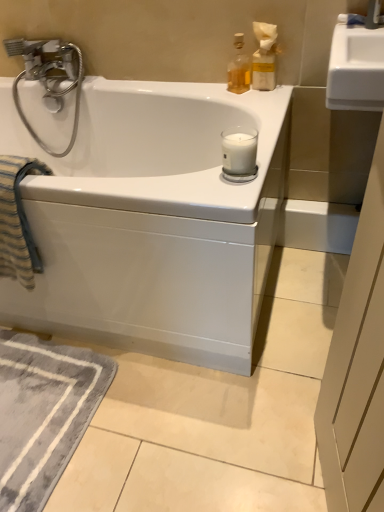
Question: From the image's perspective, is striped cotton beach towel at left under translucent glass bottle at upper right, acting as the first bottle starting from the left?

Choices:
 (A) yes
 (B) no

Answer: (A)

Question: Is striped cotton beach towel at left facing towards translucent glass bottle at upper right, acting as the first bottle starting from the left?

Choices:
 (A) no
 (B) yes

Answer: (A)

Question: Could translucent glass bottle at upper right, arranged as the 2th bottle when viewed from the right, be considered to be inside striped cotton beach towel at left?

Choices:
 (A) no
 (B) yes

Answer: (A)

Question: Can you confirm if striped cotton beach towel at left is thinner than translucent glass bottle at upper right, acting as the first bottle starting from the left?

Choices:
 (A) yes
 (B) no

Answer: (B)

Question: Is there a large distance between striped cotton beach towel at left and translucent glass bottle at upper right, acting as the first bottle starting from the left?

Choices:
 (A) yes
 (B) no

Answer: (B)

Question: Is striped cotton beach towel at left closer to camera compared to translucent glass bottle at upper right, acting as the first bottle starting from the left?

Choices:
 (A) yes
 (B) no

Answer: (A)

Question: Does gray soft rug at lower left have a greater width compared to white matte glass candle at upper right?

Choices:
 (A) no
 (B) yes

Answer: (B)

Question: Are gray soft rug at lower left and white matte glass candle at upper right located far from each other?

Choices:
 (A) no
 (B) yes

Answer: (A)

Question: From the image's perspective, is gray soft rug at lower left below white matte glass candle at upper right?

Choices:
 (A) no
 (B) yes

Answer: (B)

Question: Considering the relative sizes of gray soft rug at lower left and white matte glass candle at upper right in the image provided, is gray soft rug at lower left smaller than white matte glass candle at upper right?

Choices:
 (A) no
 (B) yes

Answer: (A)

Question: Is gray soft rug at lower left bigger than white matte glass candle at upper right?

Choices:
 (A) yes
 (B) no

Answer: (A)

Question: Can you confirm if gray soft rug at lower left is thinner than white matte glass candle at upper right?

Choices:
 (A) no
 (B) yes

Answer: (A)

Question: Can you confirm if translucent glass bottle at upper right, which is the first bottle from right to left, is smaller than white matte glass candle at upper right?

Choices:
 (A) yes
 (B) no

Answer: (B)